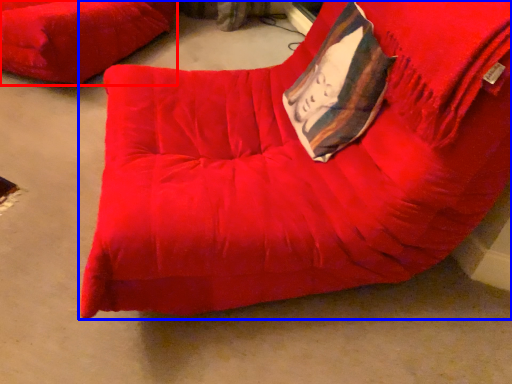
Question: Which object appears farthest to the camera in this image, furniture (highlighted by a red box) or furniture (highlighted by a blue box)?

Choices:
 (A) furniture
 (B) furniture

Answer: (A)